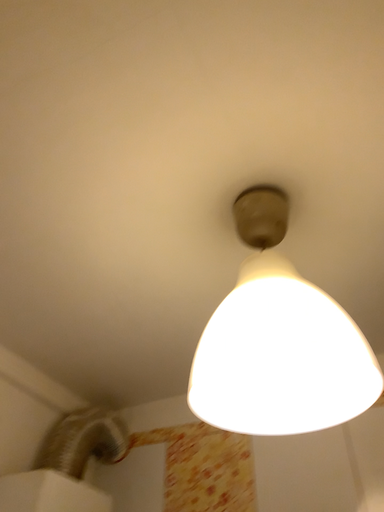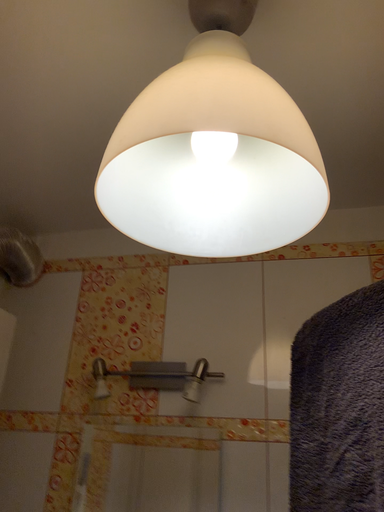
Question: Which way did the camera rotate in the video?

Choices:
 (A) rotated downward
 (B) rotated upward

Answer: (A)